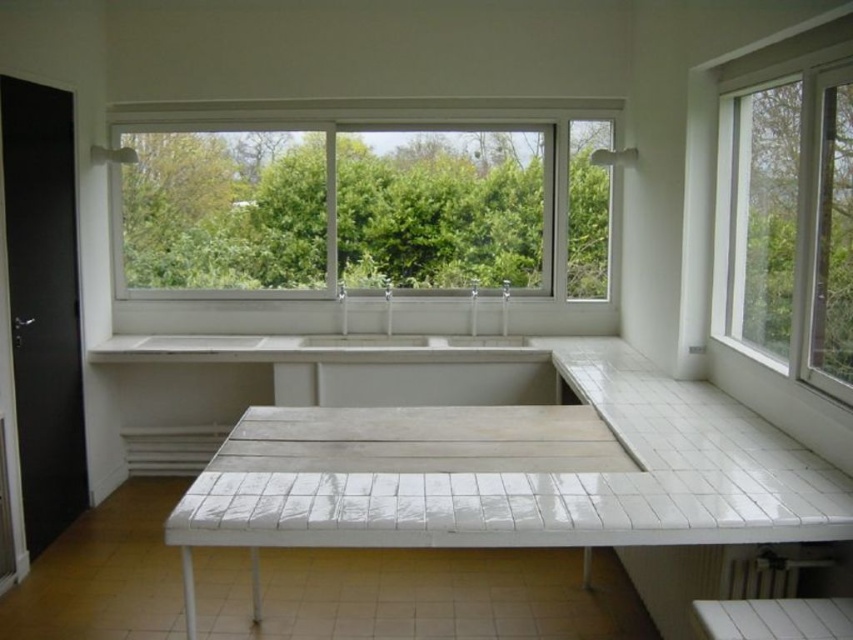
In the scene shown: You are standing in the room and want to look out through the clear glass window at center. Where should you position yourself to see the window?

You should position yourself at point (361, 205) to see the clear glass window at center.

You are a plumber inspecting the utility room. You need to replace a part that requires a sink with a minimum size of 1 meter in width. Which sink between the white ceramic sink at center and the white glossy sink at center should you choose?

The white ceramic sink at center has a larger size compared to the white glossy sink at center, so you should choose the white ceramic sink at center as it meets the minimum size requirement.

You are organizing a small event in the room and need to place a 2x2 feet table on the countertop. The clear glass window at center and the white tile table at center are already present. Which object should you avoid placing the table near to ensure it doesn

The white tile table at center is larger than the clear glass window at center, so placing the table near the clear glass window at center would leave more space for the 2x2 feet table.